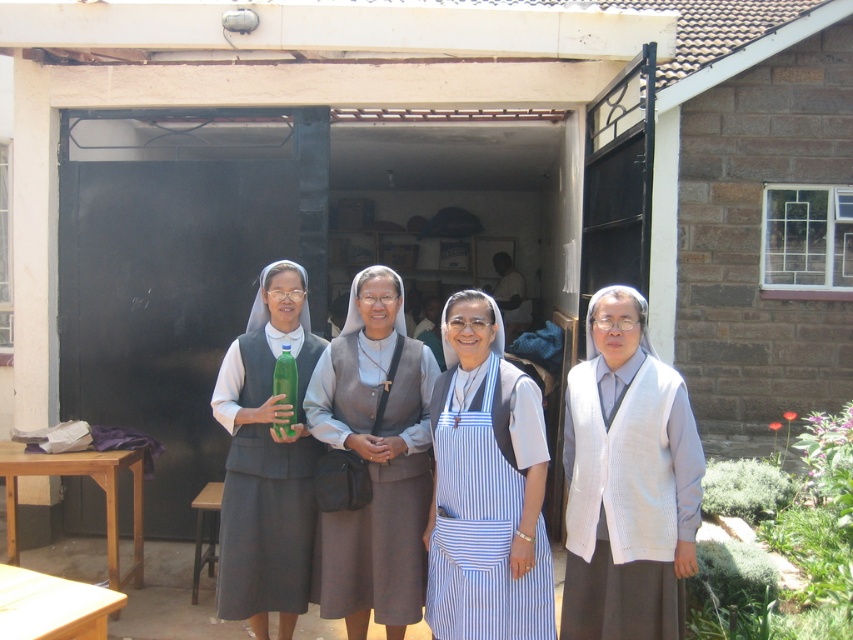
Question: Which is farther from the blue striped apron at center?

Choices:
 (A) matte gray dress at center
 (B) white knitted vest at center

Answer: (A)

Question: Can you confirm if brown fabric dress at center is smaller than matte gray dress at center?

Choices:
 (A) no
 (B) yes

Answer: (A)

Question: Among these objects, which one is farthest from the camera?

Choices:
 (A) white knitted vest at center
 (B) brown fabric dress at center
 (C) blue striped apron at center

Answer: (B)

Question: From the image, what is the correct spatial relationship of brown fabric dress at center in relation to matte gray dress at center?

Choices:
 (A) left
 (B) right

Answer: (B)

Question: Does white knitted vest at center appear on the left side of brown fabric dress at center?

Choices:
 (A) no
 (B) yes

Answer: (A)

Question: Among these objects, which one is nearest to the camera?

Choices:
 (A) matte gray dress at center
 (B) white knitted vest at center
 (C) blue striped apron at center

Answer: (B)